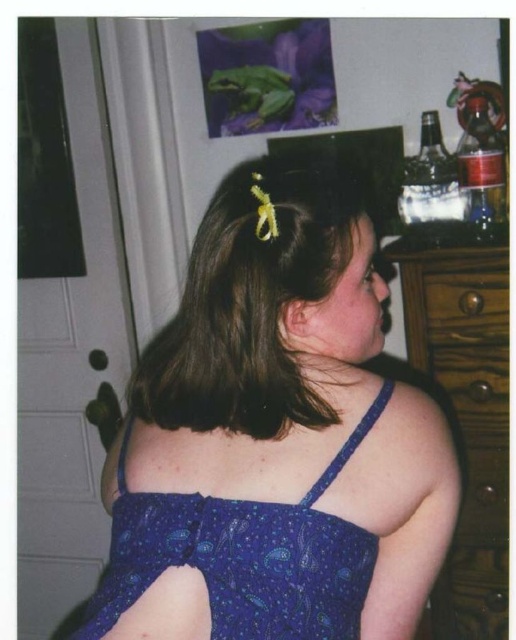
Can you confirm if blue satin dress at center is thinner than brown wooden drawer at right?

Incorrect, blue satin dress at center's width is not less than brown wooden drawer at right's.

Between blue satin dress at center and brown wooden drawer at right, which one appears on the right side from the viewer's perspective?

brown wooden drawer at right is more to the right.

Between point (255, 492) and point (467, 314), which one is positioned in front?

Point (255, 492)

I want to click on blue satin dress at center, so click(x=275, y=436).

Is blue satin dress at center shorter than blue paisley fabric dress at back?

No.

Locate an element on the screen. The image size is (516, 640). blue satin dress at center is located at coordinates (275, 436).

Is blue satin dress at center smaller than brown matte hair clip at upper center?

No, blue satin dress at center is not smaller than brown matte hair clip at upper center.

Is point (123, 493) closer to camera compared to point (205, 339)?

That is True.

Does point (153, 570) come behind point (303, 186)?

No.

In order to click on blue satin dress at center in this screenshot , I will do `click(275, 436)`.